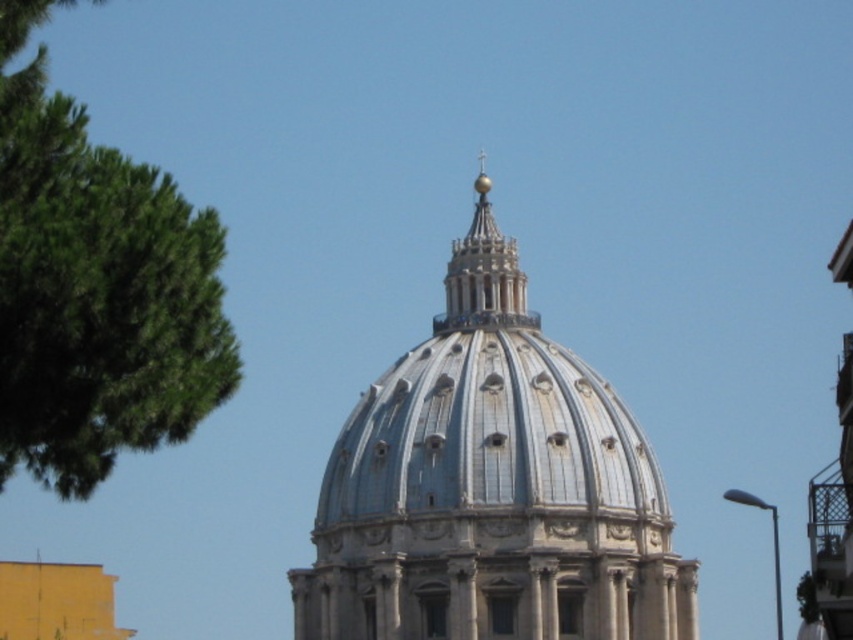
In the scene shown: You are a drone operator tasked with capturing aerial footage of the white stone dome at center and the green leafy tree at left. Your drone has a maximum flight range of 30 meters. Can the drone safely capture footage of both objects without exceeding its range?

The distance between the white stone dome at center and the green leafy tree at left is 35.77 meters, which exceeds the drone operator s maximum flight range of 30 meters. Therefore, the drone cannot safely capture footage of both objects without exceeding its range.

You are an architect visiting St. Peter Basilica. You notice two domes in the image, the white stone dome at center and the gold polished dome at upper center. Which one is taller?

The white stone dome at center is much taller than the gold polished dome at upper center.

You are standing in front of the dome of St. Peter Basilica and see the point at coordinates (96, 289). What is this point located on?

The point at coordinates (96, 289) is located on the green leafy tree at left.